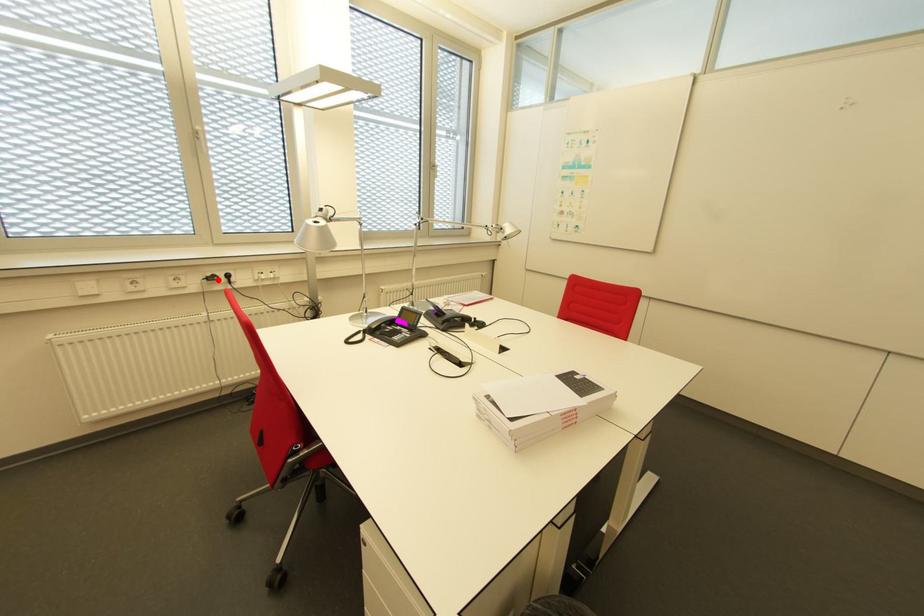
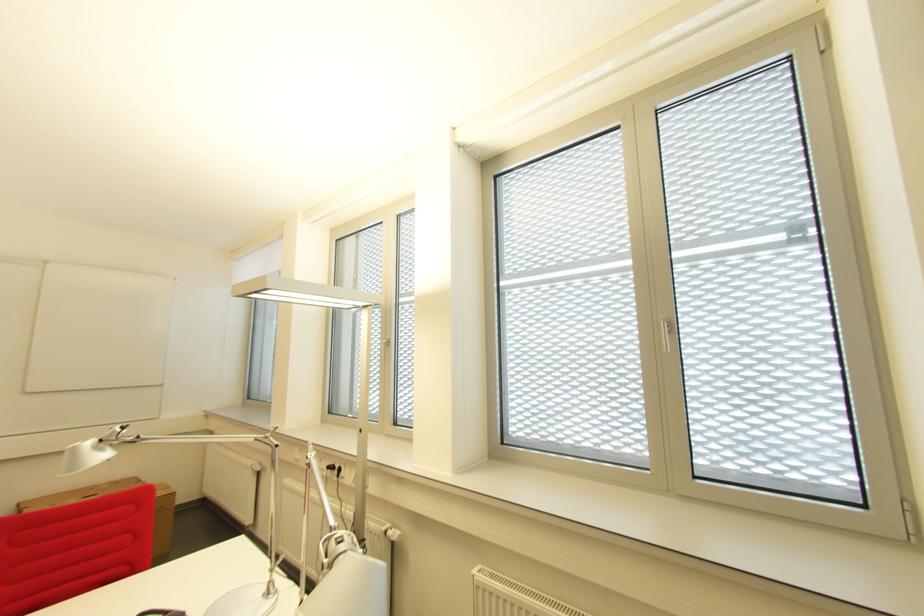
Question: I am providing you with two images of the same scene from different viewpoints. A red point is shown in image1. For the corresponding object point in image2, is it positioned nearer or farther from the camera?

Choices:
 (A) Nearer
 (B) Farther

Answer: (B)